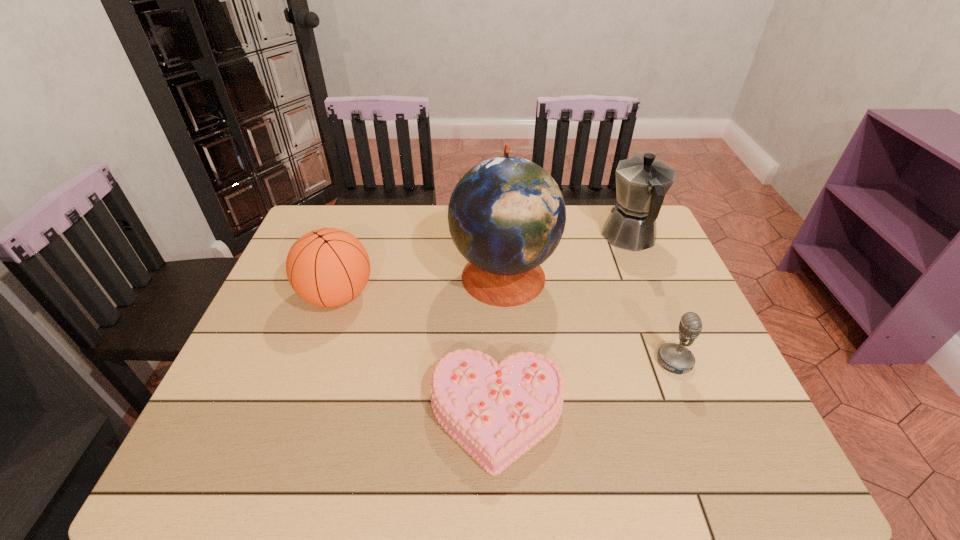
Where is `unoccupied position between the fourth tallest object and the third tallest object`? This screenshot has height=540, width=960. unoccupied position between the fourth tallest object and the third tallest object is located at coordinates (506, 328).

Locate an element on the screen. The image size is (960, 540). vacant area that lies between the basketball and the globe is located at coordinates (420, 285).

Locate an element on the screen. This screenshot has width=960, height=540. unoccupied position between the microphone and the leftmost object is located at coordinates (506, 328).

At what (x,y) coordinates should I click in order to perform the action: click on free space between the tallest object and the fourth tallest object. Please return your answer as a coordinate pair (x, y). Image resolution: width=960 pixels, height=540 pixels. Looking at the image, I should click on (589, 318).

I want to click on vacant region between the shortest object and the globe, so click(x=500, y=345).

Find the location of a particular element. This screenshot has width=960, height=540. free point between the coffeepot and the tallest object is located at coordinates (566, 256).

Identify which object is the nearest to the shortest object. Please provide its 2D coordinates. Your answer should be formatted as a tuple, i.e. [(x, y)], where the tuple contains the x and y coordinates of a point satisfying the conditions above.

[(506, 215)]

Locate an element on the screen. The image size is (960, 540). object that stands as the second closest to the globe is located at coordinates (641, 182).

Find the location of `vacant space that satisfies the following two spatial constraints: 1. on the front side of the third tallest object; 2. on the left side of the cake`. vacant space that satisfies the following two spatial constraints: 1. on the front side of the third tallest object; 2. on the left side of the cake is located at coordinates (296, 415).